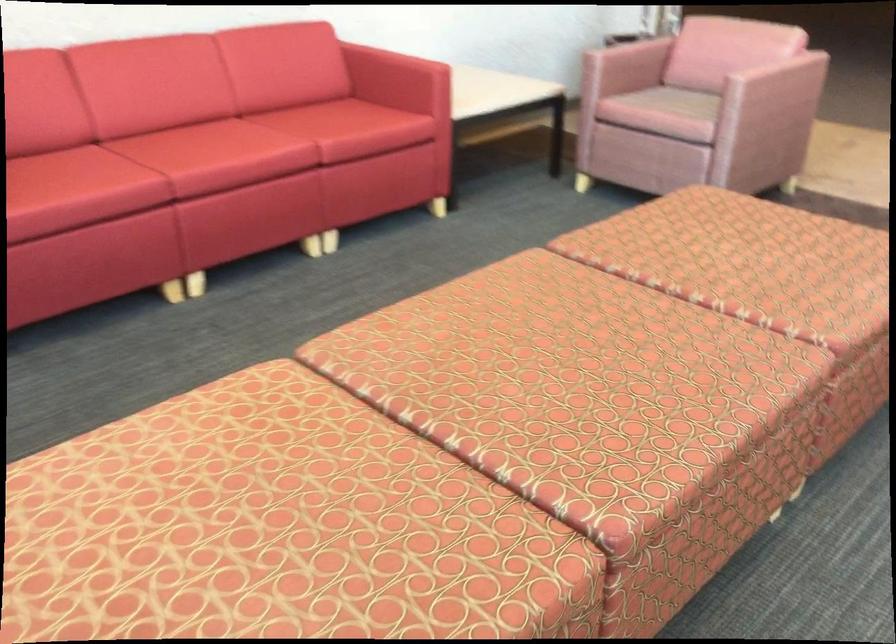
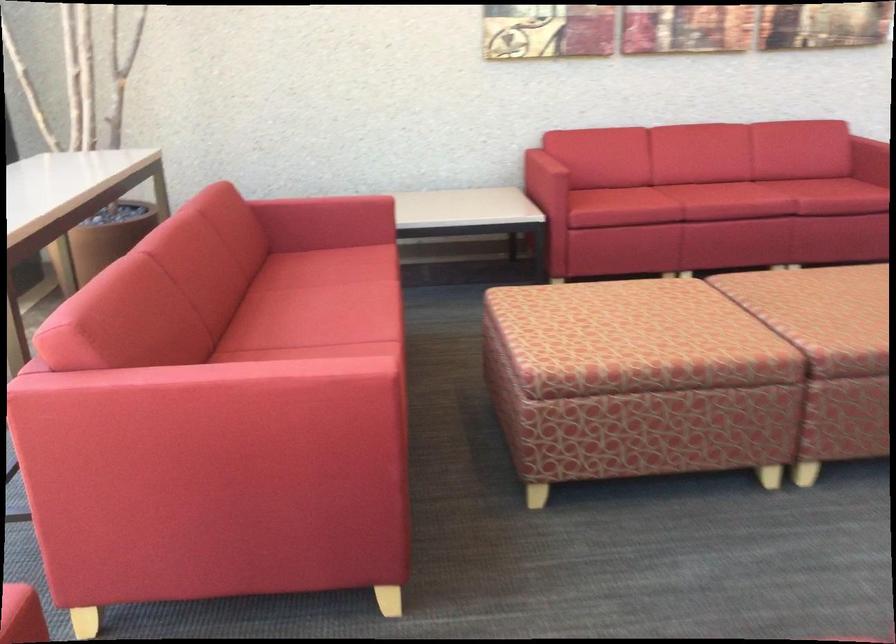
In the second image, find the point that corresponds to pixel 240 169 in the first image.

(725, 201)